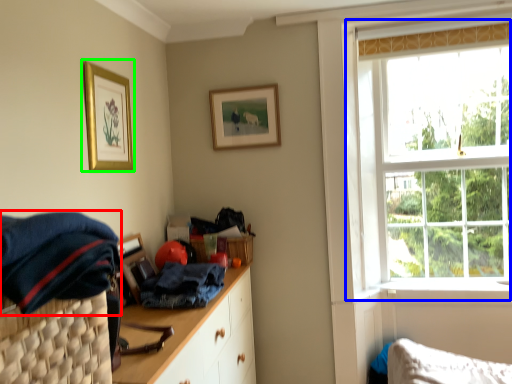
Question: Which object is the farthest from clothing (highlighted by a red box)? Choose among these: window (highlighted by a blue box) or picture frame (highlighted by a green box).

Choices:
 (A) window
 (B) picture frame

Answer: (A)